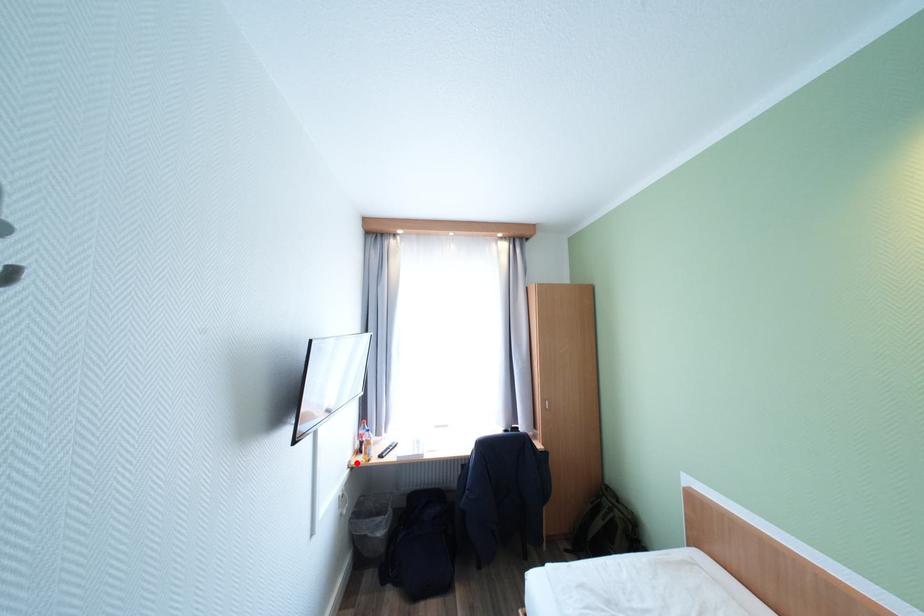
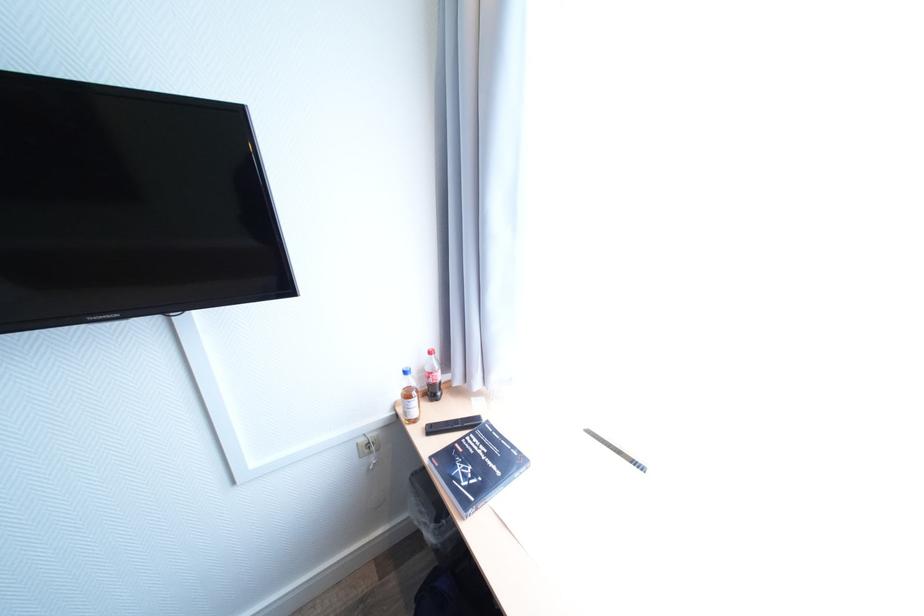
Question: I am providing you with two images of the same scene from different viewpoints. A red point is marked on the first image. Is the red point's position out of view in image 2?

Choices:
 (A) Yes
 (B) No

Answer: (B)